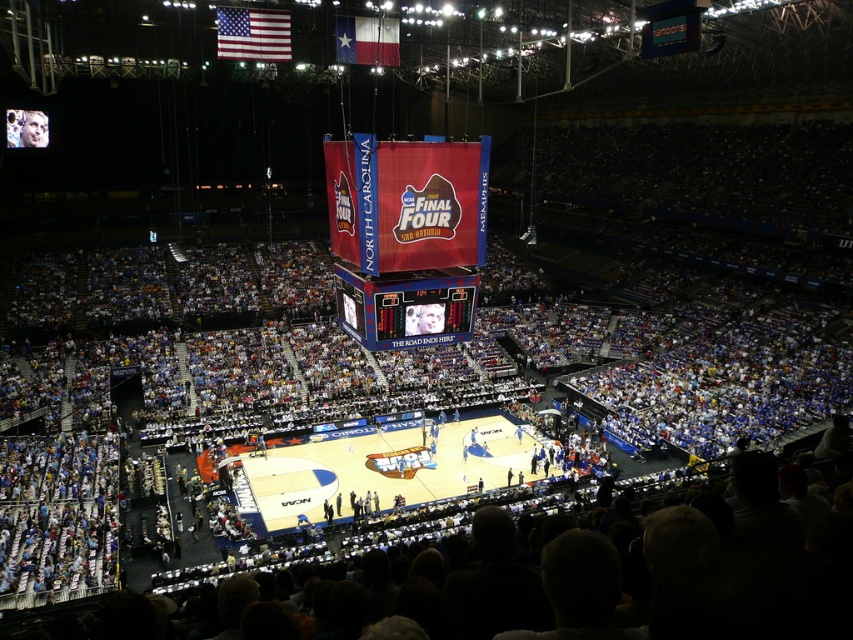
Can you confirm if white glossy basketball court at center is thinner than blue fabric flag at upper center?

In fact, white glossy basketball court at center might be wider than blue fabric flag at upper center.

Between point (457, 465) and point (369, 28), which one is positioned behind?

The point (457, 465) is more distant.

Does point (234, 465) come closer to viewer compared to point (357, 36)?

No, it is not.

I want to click on white glossy basketball court at center, so click(x=383, y=467).

Who is shorter, american flag at upper left or blue fabric flag at upper center?

american flag at upper left is shorter.

Which of these two, american flag at upper left or blue fabric flag at upper center, stands taller?

Standing taller between the two is blue fabric flag at upper center.

The height and width of the screenshot is (640, 853). I want to click on american flag at upper left, so click(x=253, y=33).

Does point (519, 464) come closer to viewer compared to point (418, 314)?

No, it is not.

What do you see at coordinates (383, 467) in the screenshot? The width and height of the screenshot is (853, 640). I see `white glossy basketball court at center` at bounding box center [383, 467].

In order to click on white glossy basketball court at center in this screenshot , I will do `click(383, 467)`.